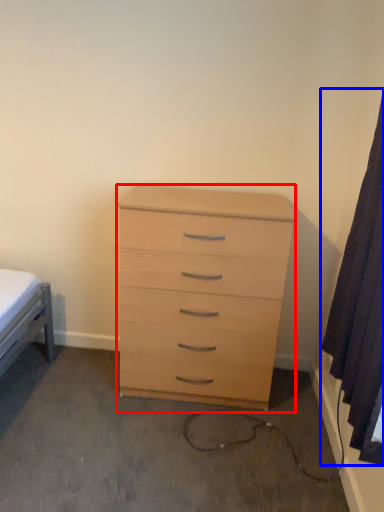
Question: Which object appears closest to the camera in this image, chest of drawers (highlighted by a red box) or curtain (highlighted by a blue box)?

Choices:
 (A) chest of drawers
 (B) curtain

Answer: (B)